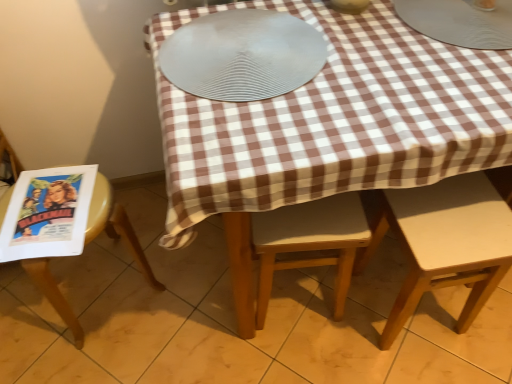
Identify the location of free spot above white matte chair at lower right, marked as the 3th chair in a left-to-right arrangement (from a real-world perspective). (456, 213).